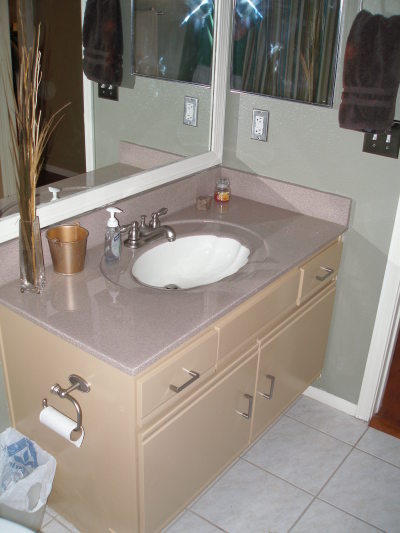
You are a GUI agent. You are given a task and a screenshot of the screen. Output one action in this format:
    pyautogui.click(x=<x>, y=<y>)
    Task: Click on the faucet handles
    
    Given the screenshot: What is the action you would take?
    pyautogui.click(x=157, y=219), pyautogui.click(x=131, y=228)